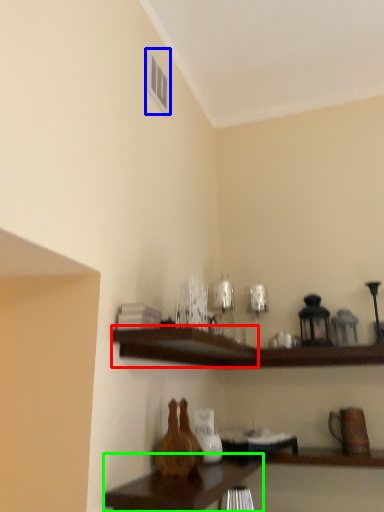
Question: Which is farther away from shelf (highlighted by a red box)? window (highlighted by a blue box) or table (highlighted by a green box)?

Choices:
 (A) window
 (B) table

Answer: (A)